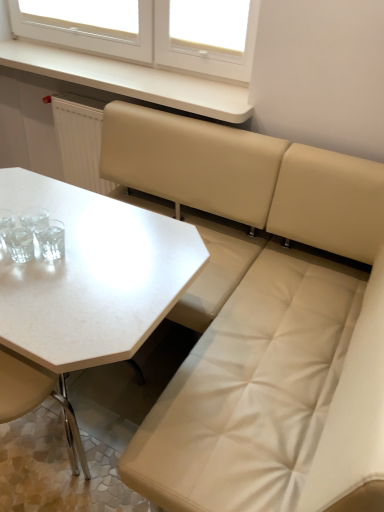
Find the location of a particular element. The height and width of the screenshot is (512, 384). blank space situated above white matte table at center (from a real-world perspective) is located at coordinates (79, 243).